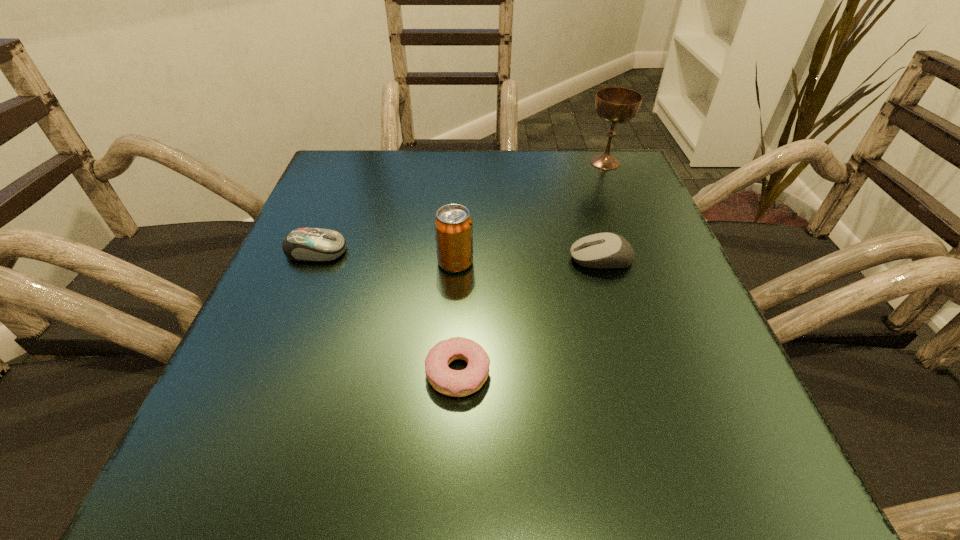
Locate an element on the screen. This screenshot has height=540, width=960. unoccupied area between the farthest object and the right computer mouse is located at coordinates (603, 211).

I want to click on unoccupied position between the fourth shortest object and the right computer mouse, so click(528, 261).

Where is `free space between the doughnut and the soda can`? The image size is (960, 540). free space between the doughnut and the soda can is located at coordinates (457, 318).

You are a GUI agent. You are given a task and a screenshot of the screen. Output one action in this format:
    pyautogui.click(x=<x>, y=<y>)
    Task: Click on the free point between the right computer mouse and the chalice
    
    Given the screenshot: What is the action you would take?
    coord(603,211)

Locate an element on the screen. free area in between the leftmost object and the doughnut is located at coordinates (387, 312).

This screenshot has width=960, height=540. Identify the location of object that is the third nearest to the right computer mouse. (615, 105).

The image size is (960, 540). Find the location of `object identified as the third closest to the second tallest object`. object identified as the third closest to the second tallest object is located at coordinates (602, 250).

Where is `free space that satisfies the following two spatial constraints: 1. on the back side of the chalice; 2. on the right side of the soda can`? The width and height of the screenshot is (960, 540). free space that satisfies the following two spatial constraints: 1. on the back side of the chalice; 2. on the right side of the soda can is located at coordinates (462, 162).

The height and width of the screenshot is (540, 960). I want to click on free space that satisfies the following two spatial constraints: 1. on the wheel side of the left computer mouse; 2. on the right side of the shortest object, so click(267, 373).

Locate an element on the screen. vacant space that satisfies the following two spatial constraints: 1. on the wheel side of the fourth shortest object; 2. on the right side of the leftmost object is located at coordinates (312, 262).